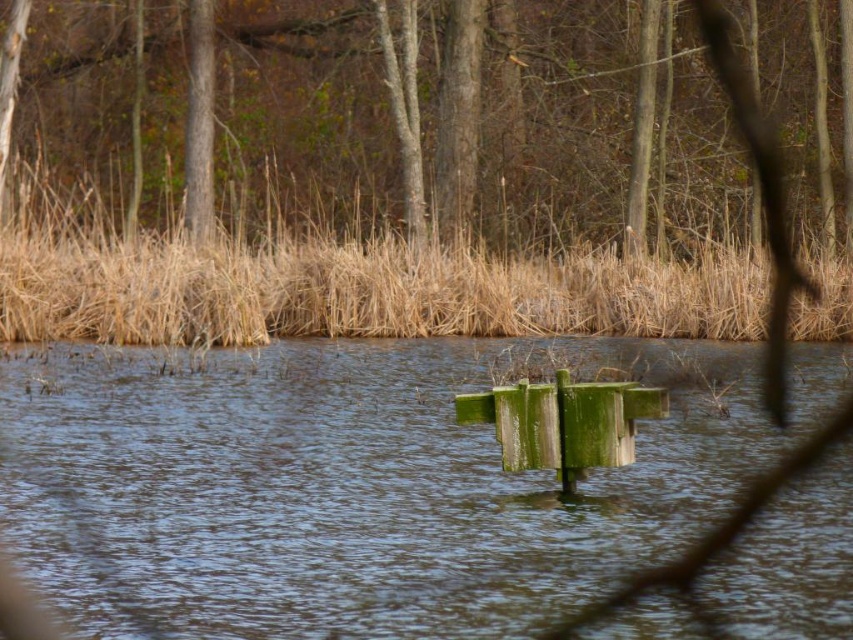
Question: Can you confirm if brown wood tree at upper center is positioned above brown dry reed at upper center?

Choices:
 (A) no
 (B) yes

Answer: (B)

Question: Which object is farther from the camera taking this photo?

Choices:
 (A) brown wood tree at upper center
 (B) brown dry reed at upper center
 (C) green mossy wood at center

Answer: (A)

Question: Does green mossy wood at center appear on the right side of brown wood tree at upper center?

Choices:
 (A) no
 (B) yes

Answer: (A)

Question: Is green mossy wood at center bigger than brown wood tree at upper center?

Choices:
 (A) no
 (B) yes

Answer: (A)

Question: Which is nearer to the green mossy wood at center?

Choices:
 (A) brown wood tree at upper center
 (B) brown dry reed at upper center

Answer: (B)

Question: Which object is the closest to the brown wood tree at upper center?

Choices:
 (A) brown dry reed at upper center
 (B) green mossy wood at center

Answer: (A)